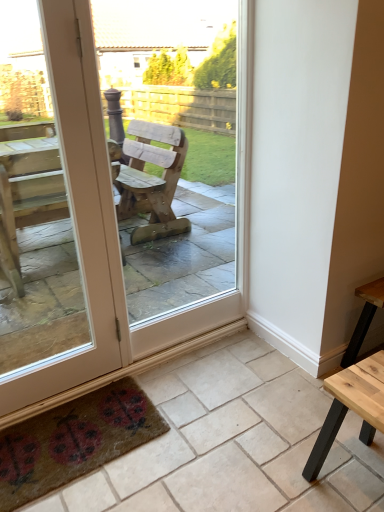
Question: Looking at the image, does textured brown mat with ladybugs at lower left seem bigger or smaller compared to light brown wooden table at lower right?

Choices:
 (A) big
 (B) small

Answer: (B)

Question: From the image's perspective, is textured brown mat with ladybugs at lower left located above or below light brown wooden table at lower right?

Choices:
 (A) above
 (B) below

Answer: (B)

Question: Which is farther from the wooden chair at center?

Choices:
 (A) brown textured mat at lower left
 (B) textured brown mat with ladybugs at lower left
 (C) light brown wooden table at lower right

Answer: (C)

Question: Which of these objects is positioned closest to the brown textured mat at lower left?

Choices:
 (A) wooden chair at center
 (B) light brown wooden table at lower right
 (C) textured brown mat with ladybugs at lower left

Answer: (C)